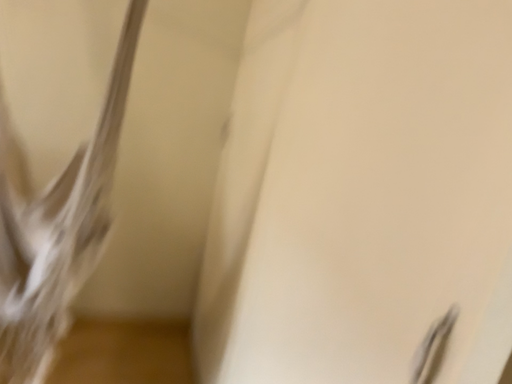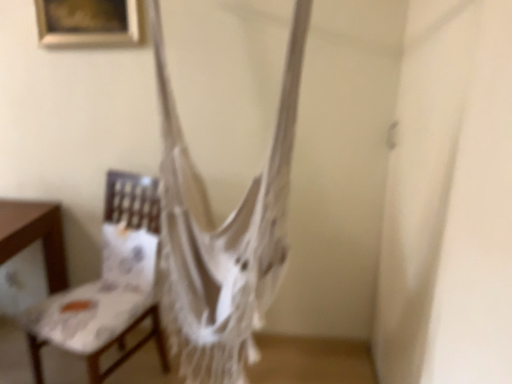
Question: Which way did the camera rotate in the video?

Choices:
 (A) rotated right
 (B) rotated left

Answer: (B)